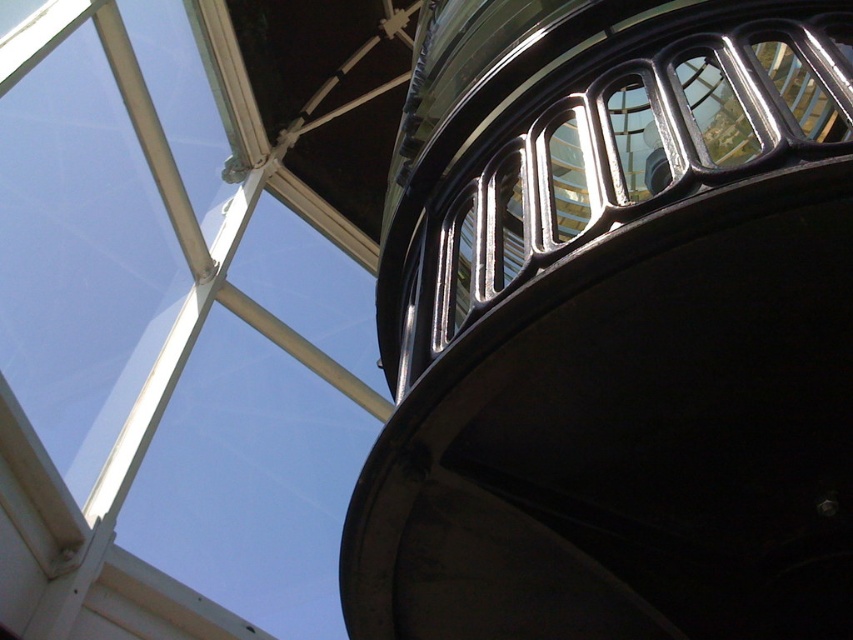
Is glossy metal tower at upper center thinner than transparent glass window at upper left?

Incorrect, glossy metal tower at upper center's width is not less than transparent glass window at upper left's.

Consider the image. Who is more forward, (799,305) or (54,193)?

Point (799,305) is more forward.

This screenshot has width=853, height=640. In order to click on glossy metal tower at upper center in this screenshot , I will do `click(614, 326)`.

Image resolution: width=853 pixels, height=640 pixels. I want to click on glossy metal tower at upper center, so click(x=614, y=326).